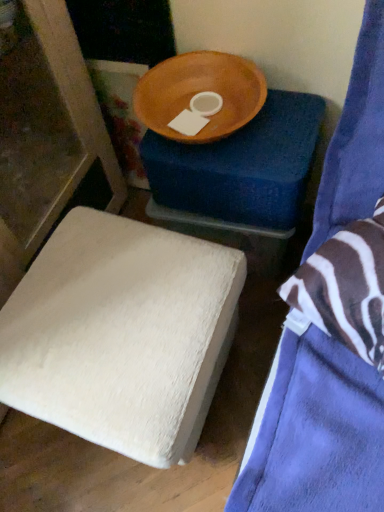
What do you see at coordinates (241, 176) in the screenshot? This screenshot has width=384, height=512. I see `wooden bowl at upper center, which ranks as the first furniture in back-to-front order` at bounding box center [241, 176].

The height and width of the screenshot is (512, 384). Identify the location of blue fabric bed at upper right, placed as the 3th furniture when sorted from back to front. (317, 434).

At what (x,y) coordinates should I click in order to perform the action: click on wooden bowl at upper center, which ranks as the first furniture in back-to-front order. Please return your answer as a coordinate pair (x, y). This screenshot has width=384, height=512. Looking at the image, I should click on (241, 176).

From the image's perspective, between blue fabric bed at upper right, acting as the 1th furniture starting from the front, and wooden bowl at upper center, who is located below?

blue fabric bed at upper right, acting as the 1th furniture starting from the front, appears lower in the image.

Considering the relative sizes of blue fabric bed at upper right, acting as the 1th furniture starting from the front, and wooden bowl at upper center in the image provided, is blue fabric bed at upper right, acting as the 1th furniture starting from the front, taller than wooden bowl at upper center?

Yes.

Locate an element on the screen. This screenshot has height=512, width=384. round table located above the blue fabric bed at upper right, acting as the 1th furniture starting from the front (from the image's perspective) is located at coordinates (200, 92).

Considering the positions of objects blue fabric bed at upper right, acting as the 1th furniture starting from the front, and white fuzzy ottoman at lower left, which is the second furniture from back to front, in the image provided, who is in front, blue fabric bed at upper right, acting as the 1th furniture starting from the front, or white fuzzy ottoman at lower left, which is the second furniture from back to front,?

blue fabric bed at upper right, acting as the 1th furniture starting from the front, is closer to the camera.

Considering the positions of objects blue fabric bed at upper right, acting as the 1th furniture starting from the front, and white fuzzy ottoman at lower left, which is counted as the second furniture, starting from the front, in the image provided, who is more to the right, blue fabric bed at upper right, acting as the 1th furniture starting from the front, or white fuzzy ottoman at lower left, which is counted as the second furniture, starting from the front,?

blue fabric bed at upper right, acting as the 1th furniture starting from the front, is more to the right.

How many degrees apart are the facing directions of blue fabric bed at upper right, placed as the 3th furniture when sorted from back to front, and white fuzzy ottoman at lower left, which is counted as the second furniture, starting from the front?

The facing directions of blue fabric bed at upper right, placed as the 3th furniture when sorted from back to front, and white fuzzy ottoman at lower left, which is counted as the second furniture, starting from the front, are 34.7 degrees apart.

Could you tell me if blue fabric bed at upper right, acting as the 1th furniture starting from the front, is turned towards white fuzzy ottoman at lower left, which is the second furniture from back to front?

No, blue fabric bed at upper right, acting as the 1th furniture starting from the front, is not aimed at white fuzzy ottoman at lower left, which is the second furniture from back to front.

In the image, is white fuzzy ottoman at lower left, which is counted as the second furniture, starting from the front, positioned in front of or behind wooden bowl at upper center, arranged as the third furniture when viewed from the front?

Visually, white fuzzy ottoman at lower left, which is counted as the second furniture, starting from the front, is located in front of wooden bowl at upper center, arranged as the third furniture when viewed from the front.

Does white fuzzy ottoman at lower left, which is the second furniture from back to front, have a smaller size compared to wooden bowl at upper center, arranged as the third furniture when viewed from the front?

Incorrect, white fuzzy ottoman at lower left, which is the second furniture from back to front, is not smaller in size than wooden bowl at upper center, arranged as the third furniture when viewed from the front.

From a real-world perspective, is white fuzzy ottoman at lower left, which is the second furniture from back to front, on wooden bowl at upper center, which ranks as the first furniture in back-to-front order?

Yes.

Is white fuzzy ottoman at lower left, which is the second furniture from back to front, turned away from wooden bowl at upper center, which ranks as the first furniture in back-to-front order?

That's right, white fuzzy ottoman at lower left, which is the second furniture from back to front, is facing away from wooden bowl at upper center, which ranks as the first furniture in back-to-front order.

Is white fuzzy ottoman at lower left, which is counted as the second furniture, starting from the front, turned away from blue fabric bed at upper right, acting as the 1th furniture starting from the front?

white fuzzy ottoman at lower left, which is counted as the second furniture, starting from the front, does not have its back to blue fabric bed at upper right, acting as the 1th furniture starting from the front.

Does white fuzzy ottoman at lower left, which is counted as the second furniture, starting from the front, have a greater height compared to blue fabric bed at upper right, acting as the 1th furniture starting from the front?

Incorrect, the height of white fuzzy ottoman at lower left, which is counted as the second furniture, starting from the front, is not larger of that of blue fabric bed at upper right, acting as the 1th furniture starting from the front.

Identify the location of the 1st furniture above the white fuzzy ottoman at lower left, which is counted as the second furniture, starting from the front (from the image's perspective). The image size is (384, 512). (317, 434).

Which object is further away from the camera taking this photo, white fuzzy ottoman at lower left, which is the second furniture from back to front, or blue fabric bed at upper right, placed as the 3th furniture when sorted from back to front?

Positioned behind is white fuzzy ottoman at lower left, which is the second furniture from back to front.

Is wooden bowl at upper center, arranged as the third furniture when viewed from the front, closer to the viewer compared to blue fabric bed at upper right, acting as the 1th furniture starting from the front?

No, it is behind blue fabric bed at upper right, acting as the 1th furniture starting from the front.

Between wooden bowl at upper center, arranged as the third furniture when viewed from the front, and blue fabric bed at upper right, placed as the 3th furniture when sorted from back to front, which one has larger width?

With larger width is blue fabric bed at upper right, placed as the 3th furniture when sorted from back to front.

This screenshot has width=384, height=512. In order to click on the 2nd furniture directly above the wooden bowl at upper center, which ranks as the first furniture in back-to-front order (from a real-world perspective) in this screenshot , I will do `click(317, 434)`.

Which is farther, (245, 209) or (252, 452)?

The point (245, 209) is farther.

Does wooden bowl at upper center have a lesser height compared to white fuzzy ottoman at lower left, which is the second furniture from back to front?

Yes.

Considering the positions of objects wooden bowl at upper center and white fuzzy ottoman at lower left, which is counted as the second furniture, starting from the front, in the image provided, who is more to the right, wooden bowl at upper center or white fuzzy ottoman at lower left, which is counted as the second furniture, starting from the front,?

From the viewer's perspective, wooden bowl at upper center appears more on the right side.

From the image's perspective, who appears lower, wooden bowl at upper center or white fuzzy ottoman at lower left, which is the second furniture from back to front?

white fuzzy ottoman at lower left, which is the second furniture from back to front, from the image's perspective.

Considering the positions of points (268, 95) and (256, 90), is point (268, 95) closer to camera compared to point (256, 90)?

No, (268, 95) is behind (256, 90).

From the image's perspective, is wooden bowl at upper center, which ranks as the first furniture in back-to-front order, above wooden bowl at upper center?

Actually, wooden bowl at upper center, which ranks as the first furniture in back-to-front order, appears below wooden bowl at upper center in the image.

Consider the image. How much distance is there between wooden bowl at upper center, which ranks as the first furniture in back-to-front order, and wooden bowl at upper center?

They are 5.57 inches apart.

Is wooden bowl at upper center, which ranks as the first furniture in back-to-front order, positioned with its back to wooden bowl at upper center?

That's not correct — wooden bowl at upper center, which ranks as the first furniture in back-to-front order, is not looking away from wooden bowl at upper center.

What are the coordinates of `the 2nd furniture to the right of the wooden bowl at upper center, counting from the anchor's position` in the screenshot? It's located at (317, 434).

From the blue fabric bed at upper right, placed as the 3th furniture when sorted from back to front, count 1st furnitures backward and point to it. Please provide its 2D coordinates.

[(122, 334)]

When comparing their distances from blue fabric bed at upper right, placed as the 3th furniture when sorted from back to front, does wooden bowl at upper center or white fuzzy ottoman at lower left, which is counted as the second furniture, starting from the front, seem closer?

The object closer to blue fabric bed at upper right, placed as the 3th furniture when sorted from back to front, is white fuzzy ottoman at lower left, which is counted as the second furniture, starting from the front.

In the scene shown: From the image, which object appears to be nearer to blue fabric bed at upper right, acting as the 1th furniture starting from the front, wooden bowl at upper center, arranged as the third furniture when viewed from the front, or wooden bowl at upper center?

Based on the image, wooden bowl at upper center, arranged as the third furniture when viewed from the front, appears to be nearer to blue fabric bed at upper right, acting as the 1th furniture starting from the front.

When comparing their distances from wooden bowl at upper center, which ranks as the first furniture in back-to-front order, does blue fabric bed at upper right, acting as the 1th furniture starting from the front, or wooden bowl at upper center seem further?

blue fabric bed at upper right, acting as the 1th furniture starting from the front.

Considering their positions, is white fuzzy ottoman at lower left, which is counted as the second furniture, starting from the front, positioned closer to wooden bowl at upper center than blue fabric bed at upper right, placed as the 3th furniture when sorted from back to front?

blue fabric bed at upper right, placed as the 3th furniture when sorted from back to front.

In the scene shown: Looking at the image, which one is located closer to wooden bowl at upper center, wooden bowl at upper center, which ranks as the first furniture in back-to-front order, or white fuzzy ottoman at lower left, which is the second furniture from back to front?

Among the two, wooden bowl at upper center, which ranks as the first furniture in back-to-front order, is located nearer to wooden bowl at upper center.

Based on their spatial positions, is wooden bowl at upper center, which ranks as the first furniture in back-to-front order, or white fuzzy ottoman at lower left, which is the second furniture from back to front, closer to blue fabric bed at upper right, acting as the 1th furniture starting from the front?

white fuzzy ottoman at lower left, which is the second furniture from back to front, lies closer to blue fabric bed at upper right, acting as the 1th furniture starting from the front, than the other object.

Considering their positions, is blue fabric bed at upper right, placed as the 3th furniture when sorted from back to front, positioned closer to white fuzzy ottoman at lower left, which is the second furniture from back to front, than wooden bowl at upper center?

blue fabric bed at upper right, placed as the 3th furniture when sorted from back to front.

When comparing their distances from blue fabric bed at upper right, placed as the 3th furniture when sorted from back to front, does white fuzzy ottoman at lower left, which is the second furniture from back to front, or wooden bowl at upper center seem closer?

Based on the image, white fuzzy ottoman at lower left, which is the second furniture from back to front, appears to be nearer to blue fabric bed at upper right, placed as the 3th furniture when sorted from back to front.

At what (x,y) coordinates should I click in order to perform the action: click on round table located between blue fabric bed at upper right, acting as the 1th furniture starting from the front, and wooden bowl at upper center, which ranks as the first furniture in back-to-front order, in the depth direction. Please return your answer as a coordinate pair (x, y). Looking at the image, I should click on click(200, 92).

Identify the location of furniture between blue fabric bed at upper right, placed as the 3th furniture when sorted from back to front, and wooden bowl at upper center in the front-back direction. (122, 334).

Locate an element on the screen. furniture located between blue fabric bed at upper right, placed as the 3th furniture when sorted from back to front, and wooden bowl at upper center, arranged as the third furniture when viewed from the front, in the depth direction is located at coordinates (122, 334).